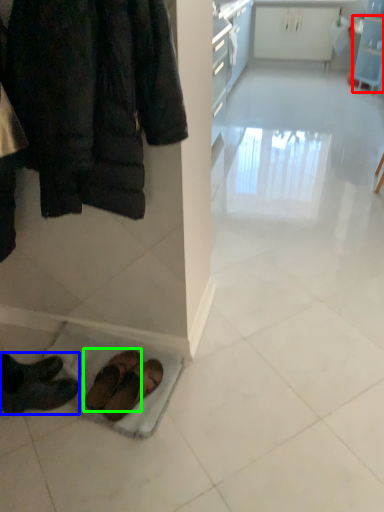
Question: Which object is the farthest from shelf (highlighted by a red box)? Choose among these: footwear (highlighted by a blue box) or footwear (highlighted by a green box).

Choices:
 (A) footwear
 (B) footwear

Answer: (A)